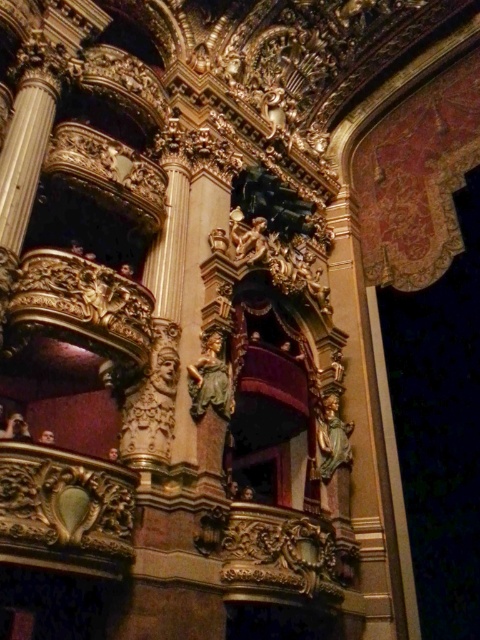
Can you confirm if green marble statue at center is positioned to the right of golden polished statue at center?

No, green marble statue at center is not to the right of golden polished statue at center.

Identify the location of green marble statue at center. The image size is (480, 640). (211, 380).

Identify the location of green marble statue at center. (211, 380).

Identify the location of green marble statue at center. The height and width of the screenshot is (640, 480). (211, 380).